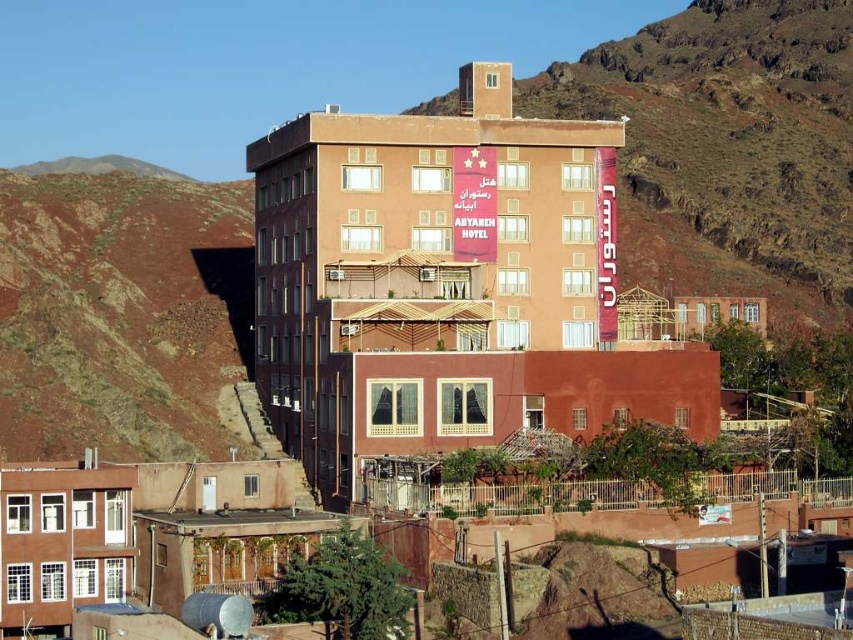
Does matte orange building at center appear over orange clay building at center?

No, matte orange building at center is not above orange clay building at center.

Is matte orange building at center wider than orange clay building at center?

In fact, matte orange building at center might be narrower than orange clay building at center.

Who is more distant from viewer, (257, 321) or (445, 100)?

The point (445, 100) is more distant.

Find the location of `matte orange building at center`. matte orange building at center is located at coordinates (444, 284).

Can you confirm if matte orange building at center is positioned above rustic clay hillside at left?

Incorrect, matte orange building at center is not positioned above rustic clay hillside at left.

Where is `matte orange building at center`? Image resolution: width=853 pixels, height=640 pixels. matte orange building at center is located at coordinates (444, 284).

Image resolution: width=853 pixels, height=640 pixels. What are the coordinates of `matte orange building at center` in the screenshot? It's located at (444, 284).

Does point (746, 264) lie behind point (135, 188)?

That is True.

Who is taller, orange clay building at center or rustic clay hillside at left?

Standing taller between the two is orange clay building at center.

Locate an element on the screen. The height and width of the screenshot is (640, 853). orange clay building at center is located at coordinates (727, 147).